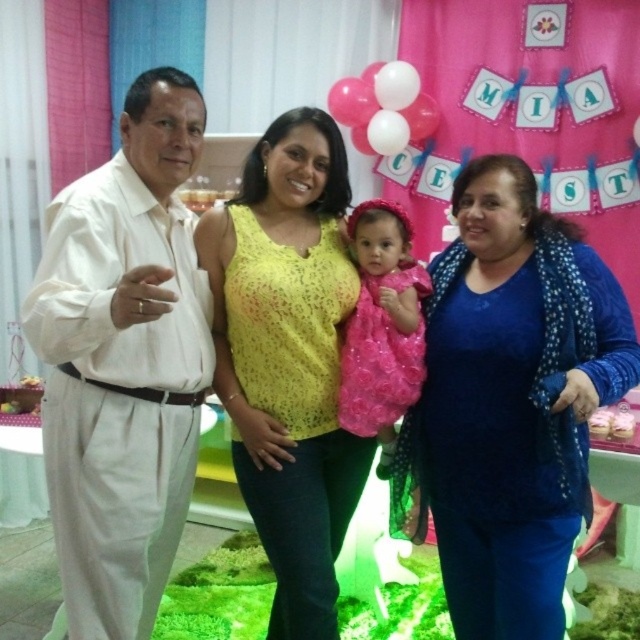
Can you confirm if white cotton shirt at left is positioned to the left of pink satin dress at center?

Correct, you'll find white cotton shirt at left to the left of pink satin dress at center.

Where is `white cotton shirt at left`? The width and height of the screenshot is (640, 640). white cotton shirt at left is located at coordinates (124, 362).

Find the location of a particular element. The width and height of the screenshot is (640, 640). white cotton shirt at left is located at coordinates (124, 362).

Who is positioned more to the right, blue textured sweater at center or yellow lace top at center?

From the viewer's perspective, blue textured sweater at center appears more on the right side.

Between blue textured sweater at center and yellow lace top at center, which one appears on the left side from the viewer's perspective?

From the viewer's perspective, yellow lace top at center appears more on the left side.

Between point (477, 522) and point (312, 112), which one is positioned in front?

Point (477, 522)

The width and height of the screenshot is (640, 640). In order to click on blue textured sweater at center in this screenshot , I will do `click(509, 403)`.

What do you see at coordinates (509, 403) in the screenshot? I see `blue textured sweater at center` at bounding box center [509, 403].

Which is behind, point (547, 586) or point (412, 264)?

Positioned behind is point (412, 264).

Is point (461, 276) farther from viewer compared to point (358, 262)?

No, it is in front of (358, 262).

Find the location of `blue textured sweater at center`. blue textured sweater at center is located at coordinates (509, 403).